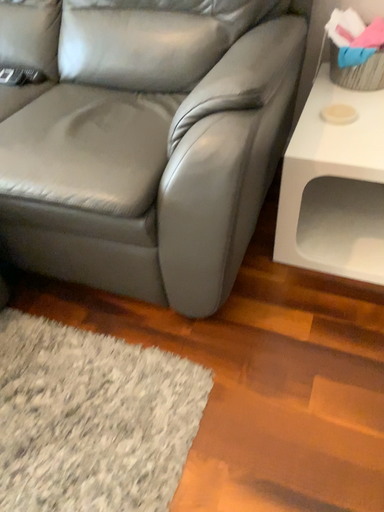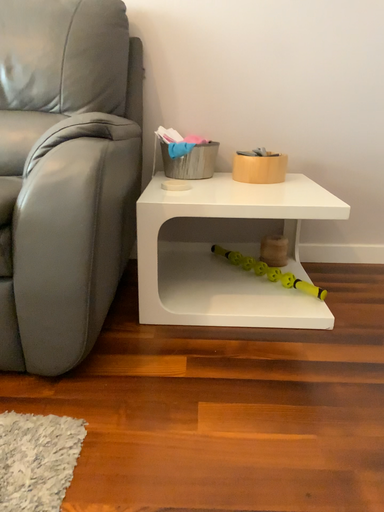
Question: Which way did the camera rotate in the video?

Choices:
 (A) rotated upward
 (B) rotated downward

Answer: (A)